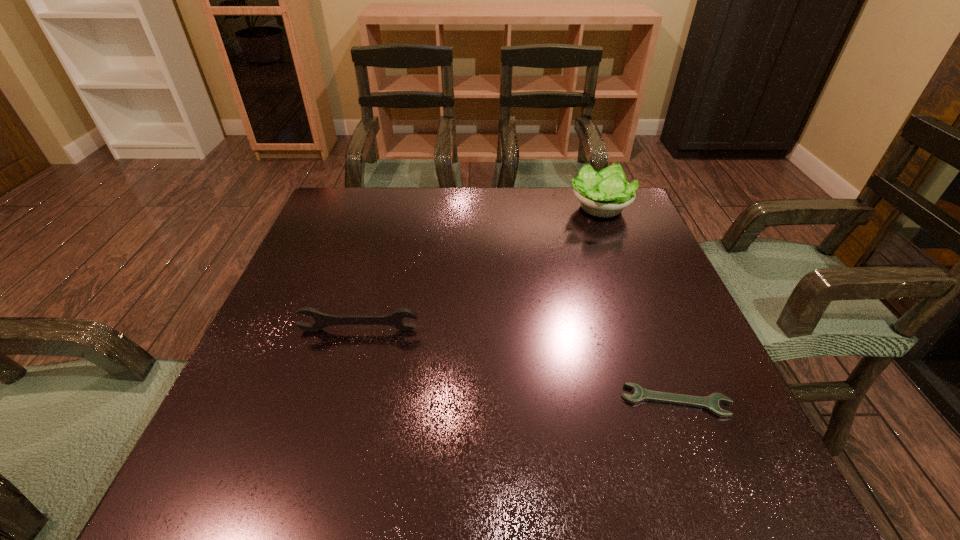
Locate an element on the screen. the tallest object is located at coordinates (606, 193).

This screenshot has height=540, width=960. Find the location of `the farthest object`. the farthest object is located at coordinates (606, 193).

At what (x,y) coordinates should I click in order to perform the action: click on the leftmost object. Please return your answer as a coordinate pair (x, y). Image resolution: width=960 pixels, height=540 pixels. Looking at the image, I should click on (322, 320).

Where is `the taller wrench`? the taller wrench is located at coordinates (322, 320).

Locate an element on the screen. This screenshot has width=960, height=540. the right wrench is located at coordinates (x=711, y=402).

Find the location of a particular element. Image resolution: width=960 pixels, height=540 pixels. the nearest object is located at coordinates (711, 402).

Identify the location of vacant space located on the left of the tallest object. The height and width of the screenshot is (540, 960). (536, 209).

You are a GUI agent. You are given a task and a screenshot of the screen. Output one action in this format:
    pyautogui.click(x=<x>, y=<y>)
    Task: Click on the vacant space located on the open ends of the second shortest object
    
    Given the screenshot: What is the action you would take?
    pyautogui.click(x=341, y=395)

At what (x,y) coordinates should I click in order to perform the action: click on object that is at the far edge. Please return your answer as a coordinate pair (x, y). Looking at the image, I should click on (606, 193).

You are a GUI agent. You are given a task and a screenshot of the screen. Output one action in this format:
    pyautogui.click(x=<x>, y=<y>)
    Task: Click on the object that is at the left edge
    Image resolution: width=960 pixels, height=540 pixels.
    Given the screenshot: What is the action you would take?
    pyautogui.click(x=322, y=320)